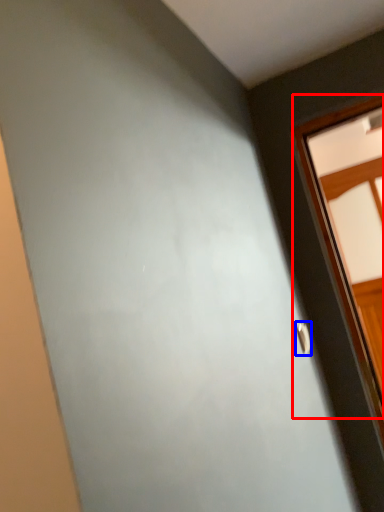
Question: Which point is further to the camera, window (highlighted by a red box) or door handle (highlighted by a blue box)?

Choices:
 (A) window
 (B) door handle

Answer: (A)